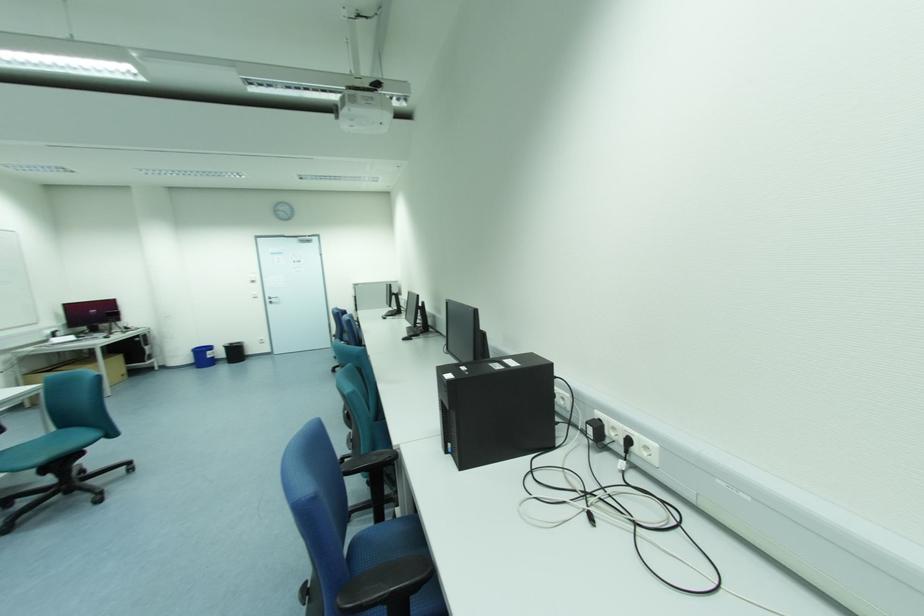
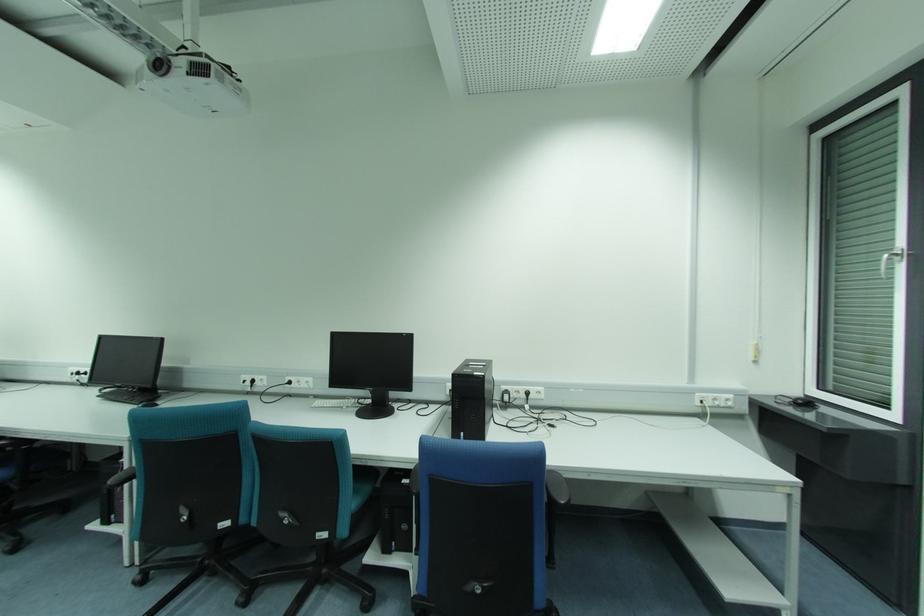
In the second image, find the point that corresponds to the point at 628,440 in the first image.

(528, 394)